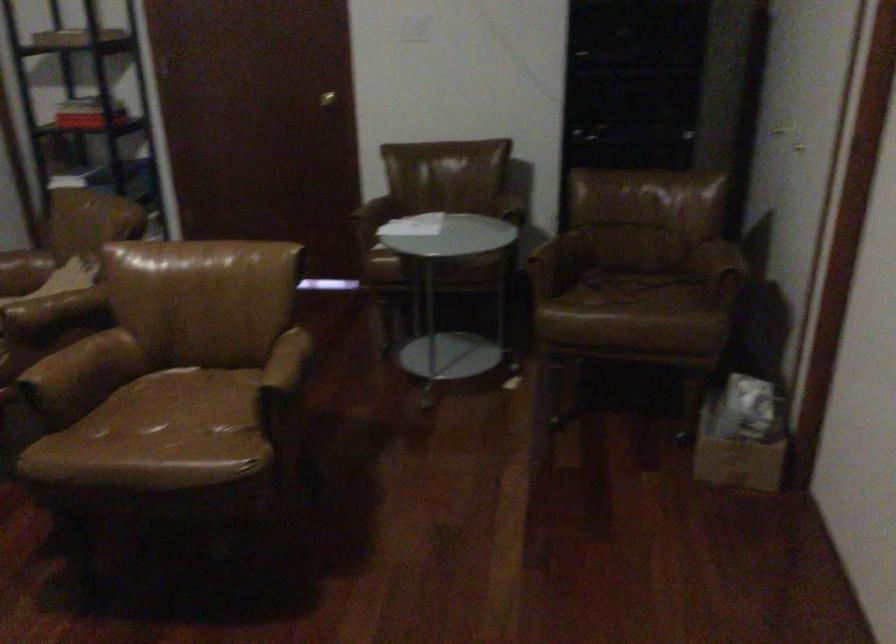
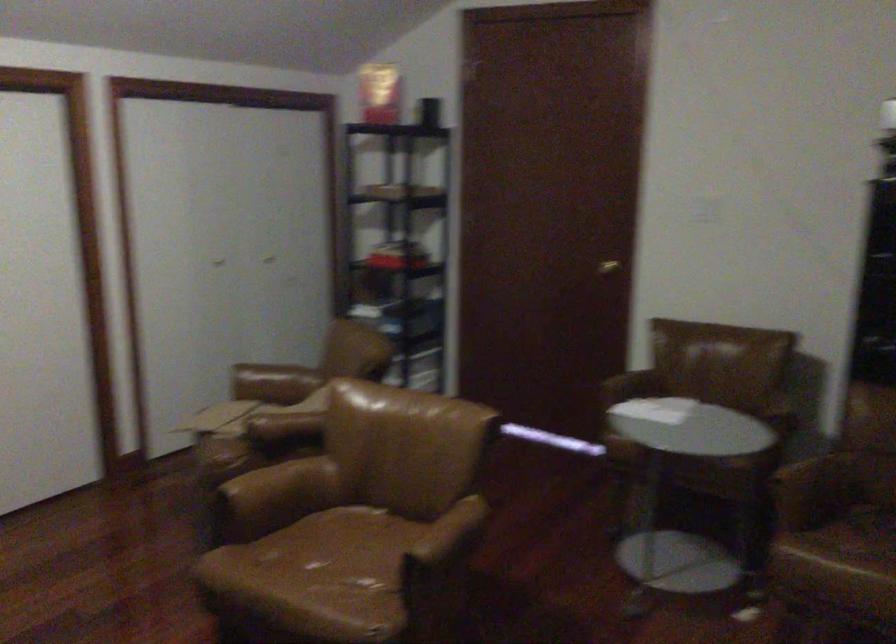
Find the pixel in the second image that matches point 314,102 in the first image.

(607, 267)